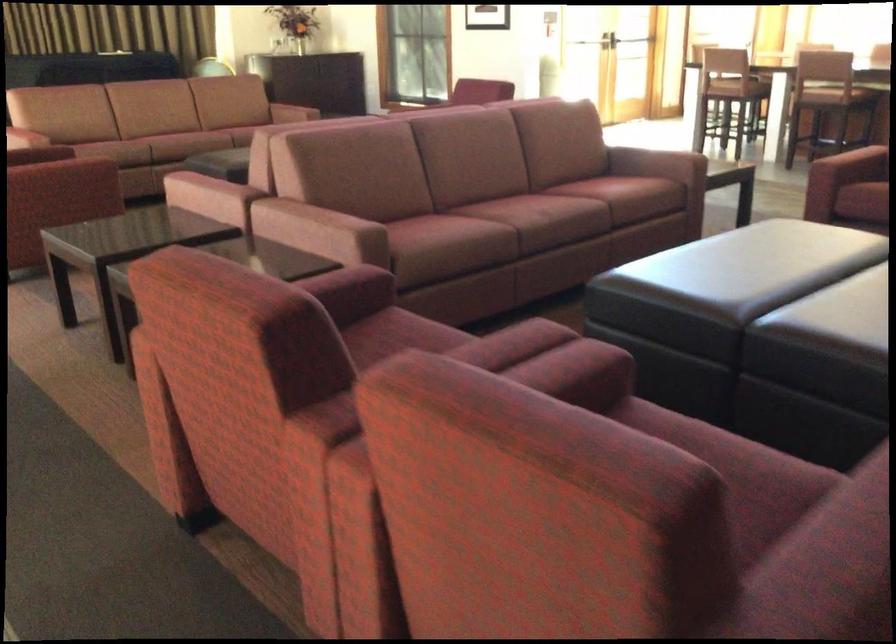
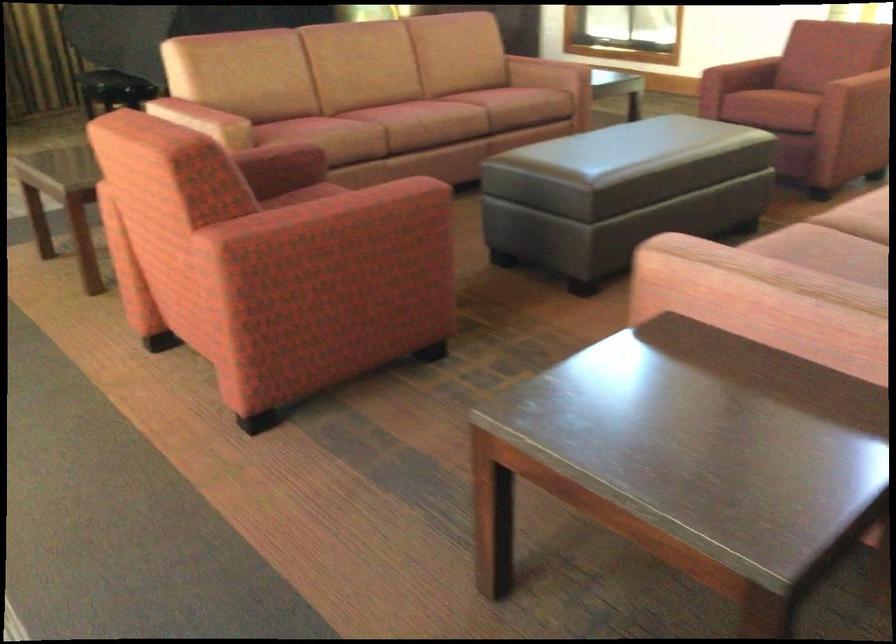
Which direction would the cameraman need to move to produce the second image?

The cameraman walked toward left, forward.